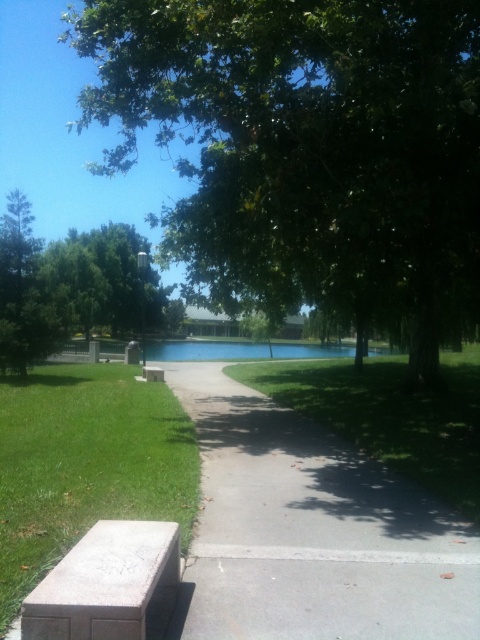
You are a photographer standing at the edge of the pathway in the park scene. You want to capture a closeup shot of the green grass at center. Given that your camera has a minimum focusing distance of 6 meters, will you be able to take the photo without moving closer?

The green grass at center is 5.92 meters away from the camera, which is within the minimum focusing distance of 6 meters. Therefore, you can take the photo without moving closer.

You are a park visitor who wants to take a photo of the green leafy tree at center and the green grass at center. Since you want both in focus, which one should you focus on first to ensure both are clear?

The green leafy tree at center is positioned over green grass at center, so you should focus on the green grass at center first to ensure both are in focus.

You are a park visitor holding a kite. You want to fly it in an open area away from the green leafy tree at center and the green grass at center. Considering their distance apart, is there enough space between them to fly the kite without hitting either?

The green leafy tree at center and the green grass at center are 10.94 feet apart. Since kites typically require more space than that, there might not be enough room between them to fly safely without hitting either object.